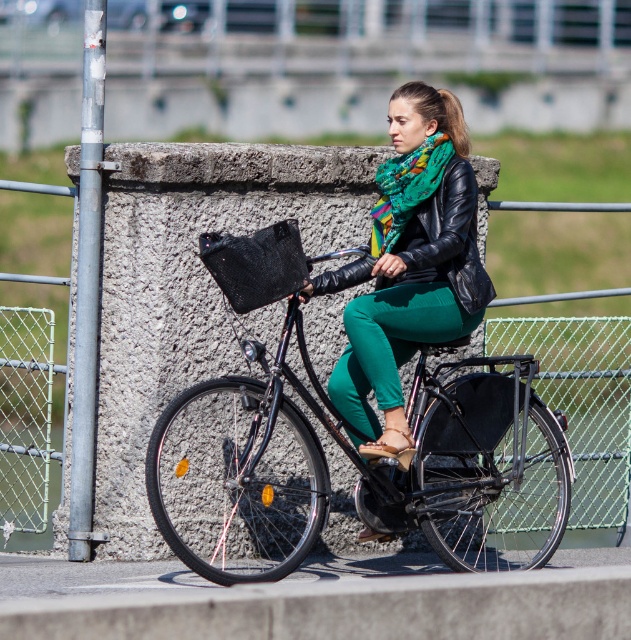
Can you confirm if green matte scarf at center is positioned to the left of multicolored knitted scarf at center?

Yes, green matte scarf at center is to the left of multicolored knitted scarf at center.

Is green matte scarf at center positioned at the back of multicolored knitted scarf at center?

No, green matte scarf at center is in front of multicolored knitted scarf at center.

The width and height of the screenshot is (631, 640). What do you see at coordinates (410, 266) in the screenshot? I see `green matte scarf at center` at bounding box center [410, 266].

The image size is (631, 640). Find the location of `green matte scarf at center`. green matte scarf at center is located at coordinates (410, 266).

Does shiny black bicycle at center have a smaller size compared to green matte scarf at center?

No, shiny black bicycle at center is not smaller than green matte scarf at center.

Who is shorter, shiny black bicycle at center or green matte scarf at center?

Standing shorter between the two is shiny black bicycle at center.

What do you see at coordinates (357, 467) in the screenshot?
I see `shiny black bicycle at center` at bounding box center [357, 467].

Find the location of `shiny black bicycle at center`. shiny black bicycle at center is located at coordinates (357, 467).

Between shiny black bicycle at center and multicolored knitted scarf at center, which one is positioned higher?

multicolored knitted scarf at center is above.

Can you confirm if shiny black bicycle at center is wider than multicolored knitted scarf at center?

Indeed, shiny black bicycle at center has a greater width compared to multicolored knitted scarf at center.

Which is behind, point (454, 445) or point (396, 216)?

The point (454, 445) is behind.

What are the coordinates of `shiny black bicycle at center` in the screenshot? It's located at (357, 467).